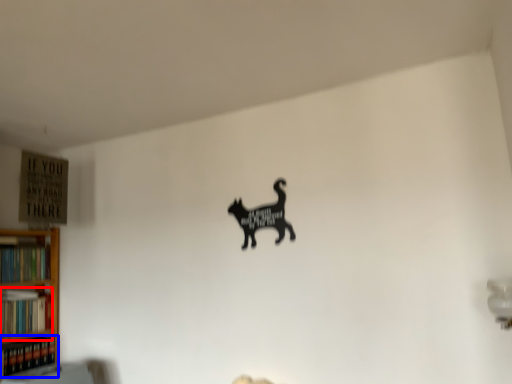
Question: Among these objects, which one is farthest to the camera, book (highlighted by a red box) or book (highlighted by a blue box)?

Choices:
 (A) book
 (B) book

Answer: (A)